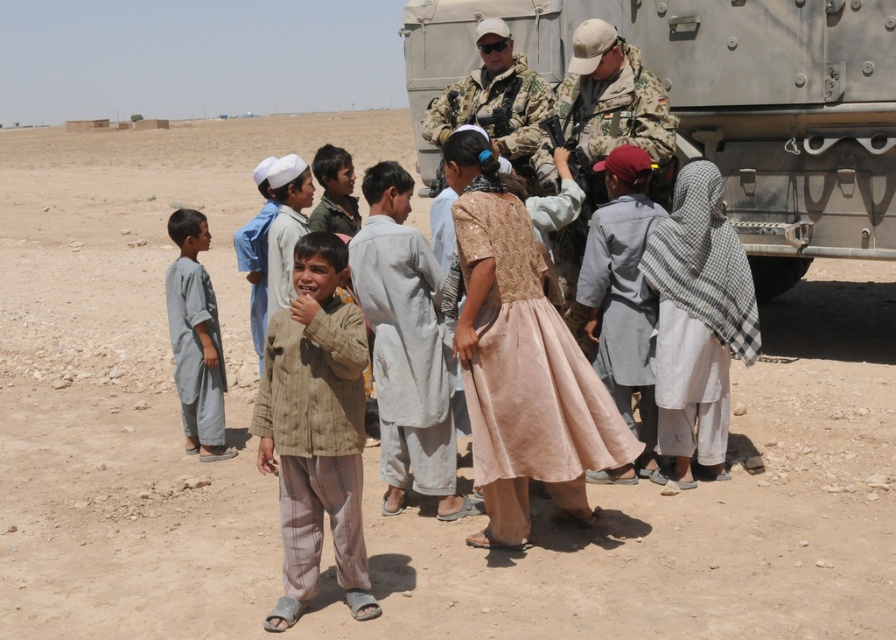
Between gray metallic tank at center and gray cotton robe at left, which one is positioned higher?

gray metallic tank at center is higher up.

Locate an element on the screen. gray metallic tank at center is located at coordinates (726, 104).

Is gray cotton robe at left thinner than camouflage uniform at center?

Yes.

Who is positioned more to the right, gray cotton robe at left or camouflage uniform at center?

camouflage uniform at center

At what (x,y) coordinates should I click in order to perform the action: click on gray cotton robe at left. Please return your answer as a coordinate pair (x, y). This screenshot has width=896, height=640. Looking at the image, I should click on (195, 339).

Which is in front, point (760, 19) or point (531, 93)?

Point (531, 93) is more forward.

Which is behind, point (798, 182) or point (520, 106)?

Positioned behind is point (798, 182).

Locate an element on the screen. This screenshot has width=896, height=640. gray metallic tank at center is located at coordinates (726, 104).